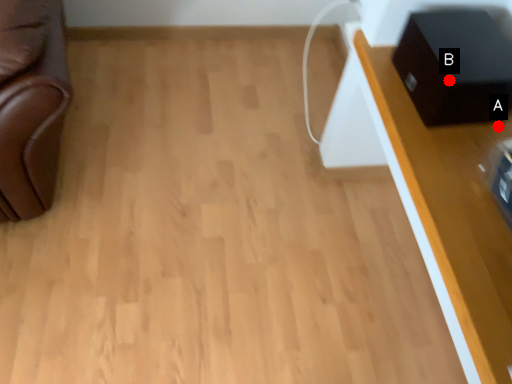
Question: Two points are circled on the image, labeled by A and B beside each circle. Which point is further to the camera?

Choices:
 (A) A is further
 (B) B is further

Answer: (A)